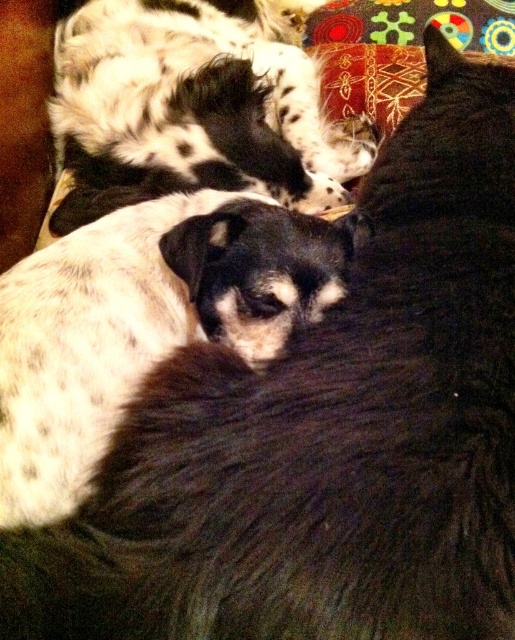
You are a dog owner who wants to take a photo of both spotted fur dog at center and spotted fur dog at upper left. Since the dogs are resting, you need to ensure you don not disturb them. Can you tell me which dog is closer to the camera so I can focus on it first?

The spotted fur dog at upper left is closer to the camera because it is positioned over the spotted fur dog at center, which means it is in front.

You are a dog owner who wants to ensure both dogs have enough space to stretch out comfortably. Given that the spotted fur dog at center is smaller than the spotted fur dog at upper left, which dog requires a larger area to accommodate its size?

The spotted fur dog at upper left requires a larger area because it is taller than the spotted fur dog at center.

You are a photographer trying to capture a closeup of the spotted fur dog at center without the spotted fur dog at upper left blocking the view. Is this possible given their positions?

The spotted fur dog at center is in front of the spotted fur dog at upper left, so you can capture a clear closeup of the spotted fur dog at center without obstruction from the other dog.